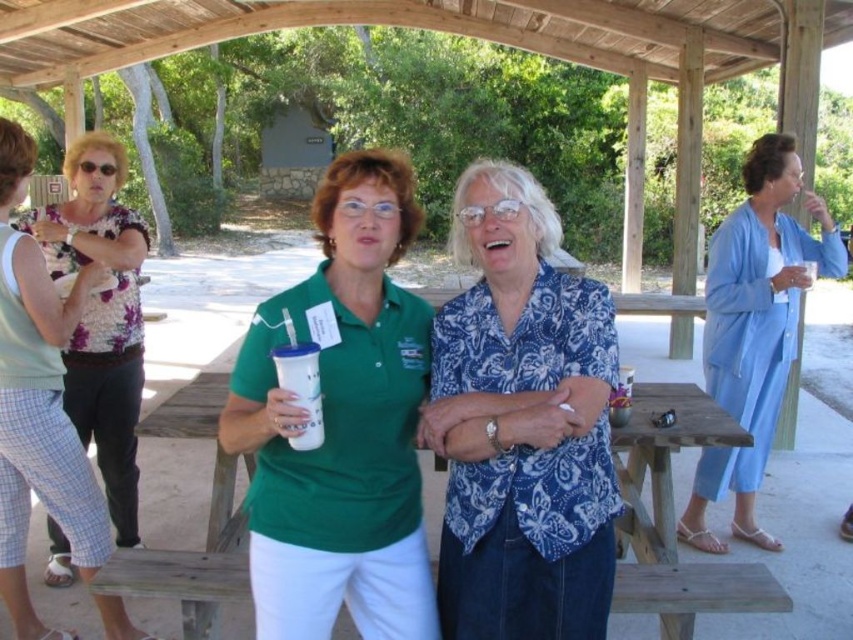
Question: Does wooden picnic table at center have a lesser width compared to floral print blouse at left?

Choices:
 (A) yes
 (B) no

Answer: (A)

Question: Which object is the farthest from the floral print blouse at left?

Choices:
 (A) light blue fabric dress at right
 (B) green matte shirt at center
 (C) wooden picnic table at center

Answer: (A)

Question: Which of the following is the farthest from the observer?

Choices:
 (A) (15, 525)
 (B) (663, 429)
 (C) (769, 193)
 (D) (445, 304)

Answer: (C)

Question: Does green matte shirt at center appear under light blue fabric dress at right?

Choices:
 (A) yes
 (B) no

Answer: (A)

Question: Which point is closer to the camera?

Choices:
 (A) (639, 556)
 (B) (10, 548)
 (C) (752, 369)
 (D) (390, 572)

Answer: (D)

Question: Can you confirm if blue paisley shirt at center is positioned below green matte shirt at center?

Choices:
 (A) no
 (B) yes

Answer: (A)